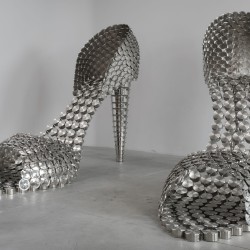
The height and width of the screenshot is (250, 250). I want to click on counter, so click(122, 206).